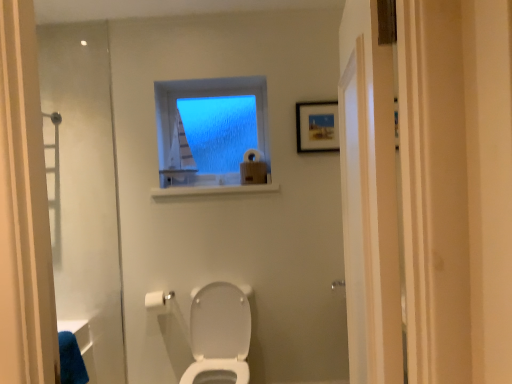
Question: Does white glossy toilet at center touch white matte toilet paper at upper center, placed as the second toilet paper when sorted from bottom to top?

Choices:
 (A) yes
 (B) no

Answer: (B)

Question: Considering the relative sizes of white glossy toilet at center and white matte toilet paper at upper center, which is the 1th toilet paper from top to bottom, in the image provided, is white glossy toilet at center thinner than white matte toilet paper at upper center, which is the 1th toilet paper from top to bottom,?

Choices:
 (A) yes
 (B) no

Answer: (B)

Question: Can you confirm if white glossy toilet at center is bigger than white matte toilet paper at upper center, the first toilet paper positioned from the right?

Choices:
 (A) yes
 (B) no

Answer: (A)

Question: Is white glossy toilet at center at the left side of white matte toilet paper at upper center, placed as the second toilet paper when sorted from bottom to top?

Choices:
 (A) yes
 (B) no

Answer: (A)

Question: Considering the relative sizes of white glossy toilet at center and white matte toilet paper at upper center, placed as the second toilet paper when sorted from bottom to top, in the image provided, is white glossy toilet at center wider than white matte toilet paper at upper center, placed as the second toilet paper when sorted from bottom to top,?

Choices:
 (A) no
 (B) yes

Answer: (B)

Question: Considering their positions, is blue frosted glass window at upper center located in front of or behind white matte toilet paper at lower center, the 2th toilet paper viewed from the back?

Choices:
 (A) behind
 (B) front

Answer: (A)

Question: In terms of size, does blue frosted glass window at upper center appear bigger or smaller than white matte toilet paper at lower center, the second toilet paper from the top?

Choices:
 (A) big
 (B) small

Answer: (A)

Question: Considering the positions of blue frosted glass window at upper center and white matte toilet paper at lower center, the first toilet paper ordered from the bottom, in the image, is blue frosted glass window at upper center wider or thinner than white matte toilet paper at lower center, the first toilet paper ordered from the bottom,?

Choices:
 (A) wide
 (B) thin

Answer: (B)

Question: Visually, is blue frosted glass window at upper center positioned to the left or to the right of white matte toilet paper at lower center, the first toilet paper ordered from the bottom?

Choices:
 (A) left
 (B) right

Answer: (B)

Question: From a real-world perspective, is white matte toilet paper at lower center, the 2th toilet paper viewed from the back, above or below wooden framed picture at upper right?

Choices:
 (A) above
 (B) below

Answer: (B)

Question: Based on their positions, is white matte toilet paper at lower center, the first toilet paper ordered from the bottom, located to the left or right of wooden framed picture at upper right?

Choices:
 (A) left
 (B) right

Answer: (A)

Question: Is white matte toilet paper at lower center, the 2th toilet paper viewed from the back, in front of or behind wooden framed picture at upper right in the image?

Choices:
 (A) front
 (B) behind

Answer: (A)

Question: From the image's perspective, is white matte toilet paper at lower center, the second toilet paper from the top, located above or below wooden framed picture at upper right?

Choices:
 (A) below
 (B) above

Answer: (A)

Question: Considering the positions of white matte toilet paper at upper center, the 2th toilet paper positioned from the left, and white glossy toilet at center in the image, is white matte toilet paper at upper center, the 2th toilet paper positioned from the left, wider or thinner than white glossy toilet at center?

Choices:
 (A) wide
 (B) thin

Answer: (B)

Question: Considering the positions of point (247, 153) and point (210, 314), is point (247, 153) closer or farther from the camera than point (210, 314)?

Choices:
 (A) closer
 (B) farther

Answer: (B)